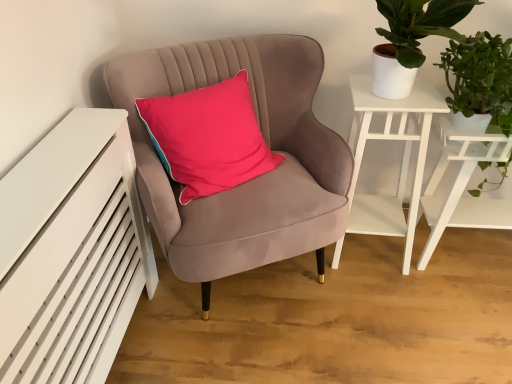
Question: Is white matte side table at upper right smaller than white matte table at right?

Choices:
 (A) yes
 (B) no

Answer: (A)

Question: Is white matte side table at upper right next to white matte table at right?

Choices:
 (A) no
 (B) yes

Answer: (A)

Question: Does white matte side table at upper right lie behind white matte table at right?

Choices:
 (A) no
 (B) yes

Answer: (A)

Question: From the image's perspective, would you say white matte side table at upper right is shown under white matte table at right?

Choices:
 (A) yes
 (B) no

Answer: (B)

Question: Considering the relative positions of white matte side table at upper right and white matte table at right in the image provided, is white matte side table at upper right to the right of white matte table at right from the viewer's perspective?

Choices:
 (A) no
 (B) yes

Answer: (A)

Question: From the image's perspective, would you say white matte side table at upper right is positioned over white matte table at right?

Choices:
 (A) yes
 (B) no

Answer: (A)

Question: Does green leafy plant at upper right have a smaller size compared to white matte side table at upper right?

Choices:
 (A) no
 (B) yes

Answer: (B)

Question: Is green leafy plant at upper right behind white matte side table at upper right?

Choices:
 (A) no
 (B) yes

Answer: (A)

Question: From a real-world perspective, is green leafy plant at upper right located beneath white matte side table at upper right?

Choices:
 (A) no
 (B) yes

Answer: (A)

Question: Considering the relative sizes of green leafy plant at upper right and white matte side table at upper right in the image provided, is green leafy plant at upper right taller than white matte side table at upper right?

Choices:
 (A) no
 (B) yes

Answer: (A)

Question: Is green leafy plant at upper right far away from white matte side table at upper right?

Choices:
 (A) no
 (B) yes

Answer: (A)

Question: Can you confirm if green leafy plant at upper right is shorter than white matte side table at upper right?

Choices:
 (A) yes
 (B) no

Answer: (A)

Question: Is velvet pink chair at center surrounding white matte side table at upper right?

Choices:
 (A) no
 (B) yes

Answer: (A)